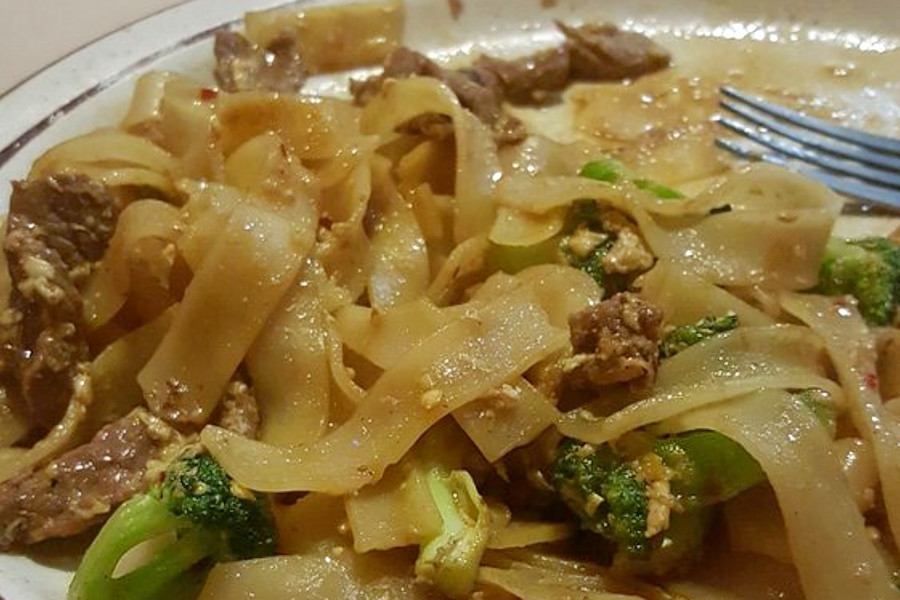
You are a GUI agent. You are given a task and a screenshot of the screen. Output one action in this format:
    pyautogui.click(x=<x>, y=<y>)
    Task: Click on the silver fork tines
    The image size is (900, 600).
    Given the screenshot: What is the action you would take?
    pyautogui.click(x=780, y=111), pyautogui.click(x=776, y=124), pyautogui.click(x=767, y=138), pyautogui.click(x=761, y=156)